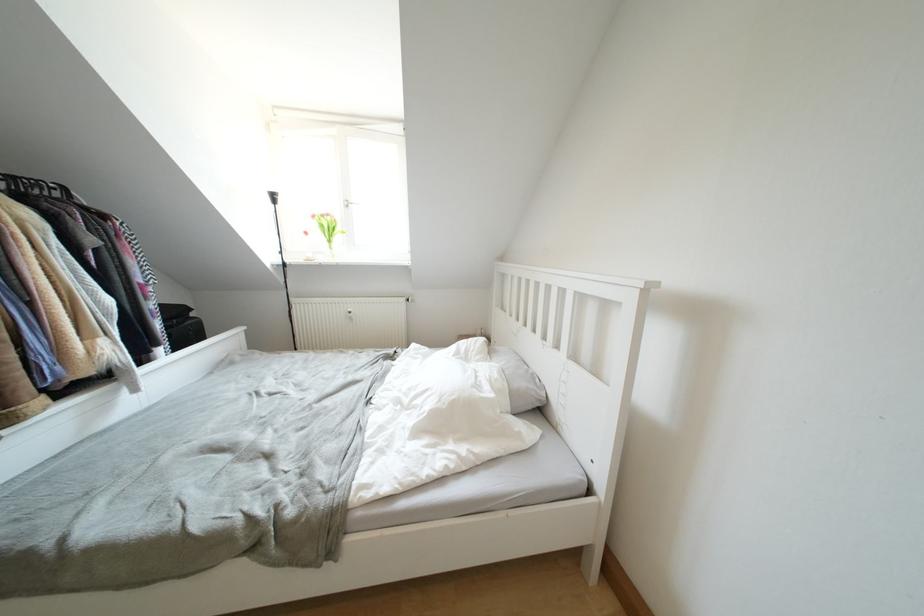
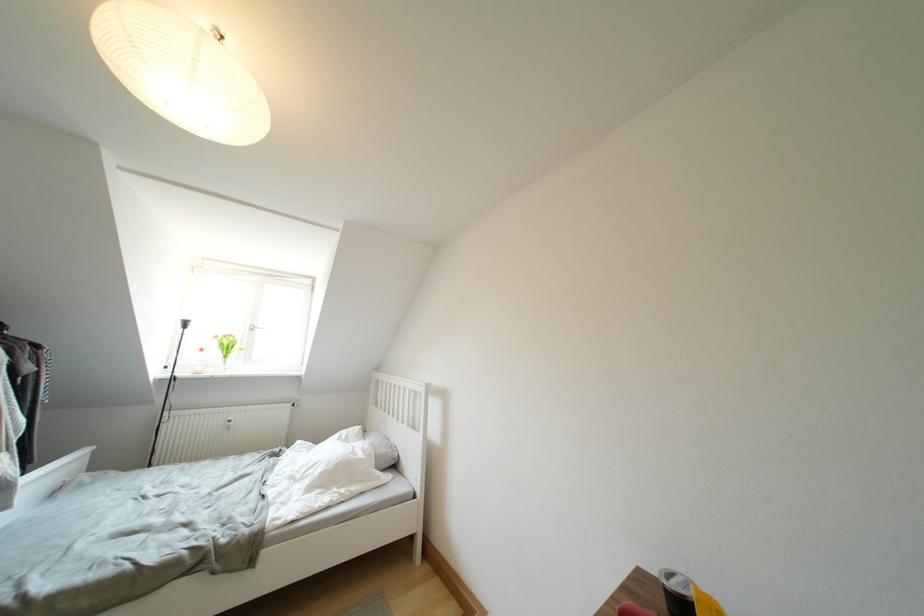
The point at [527,387] is marked in the first image. Where is the corresponding point in the second image?

(388, 454)